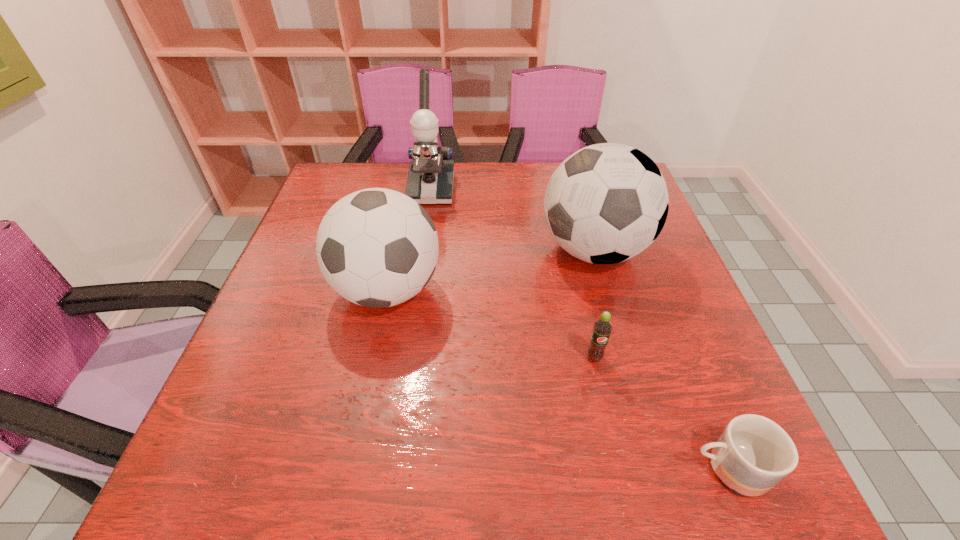
Locate an element on the screen. vacant region that satisfies the following two spatial constraints: 1. on the main logo of the right soccer ball; 2. on the front label of the second shortest object is located at coordinates (624, 357).

Locate an element on the screen. vacant position in the image that satisfies the following two spatial constraints: 1. on the main logo of the right soccer ball; 2. on the front label of the soda is located at coordinates (624, 357).